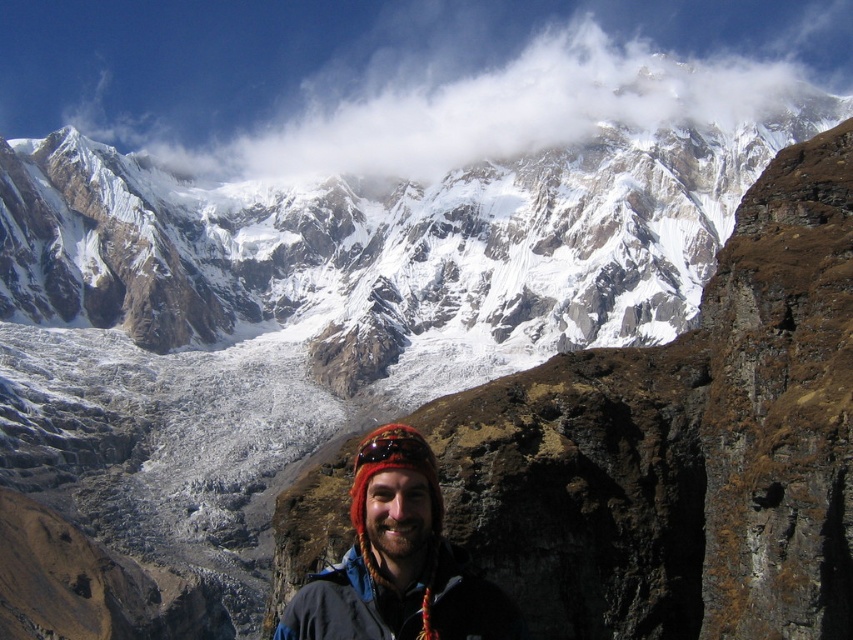
Question: Based on their relative distances, which object is farther from the knitted wool hat at center?

Choices:
 (A) dark blue fleece jacket at lower center
 (B) white fluffy cloud at upper center

Answer: (B)

Question: Based on their relative distances, which object is nearer to the white fluffy cloud at upper center?

Choices:
 (A) dark blue fleece jacket at lower center
 (B) knitted wool hat at center

Answer: (B)

Question: Observing the image, what is the correct spatial positioning of knitted wool hat at center in reference to dark blue fleece jacket at lower center?

Choices:
 (A) right
 (B) left

Answer: (B)

Question: Among these points, which one is farthest from the camera?

Choices:
 (A) (350, 563)
 (B) (381, 502)

Answer: (A)

Question: Can you confirm if knitted wool hat at center is smaller than dark blue fleece jacket at lower center?

Choices:
 (A) yes
 (B) no

Answer: (B)

Question: Can you confirm if white fluffy cloud at upper center is bigger than knitted wool hat at center?

Choices:
 (A) no
 (B) yes

Answer: (B)